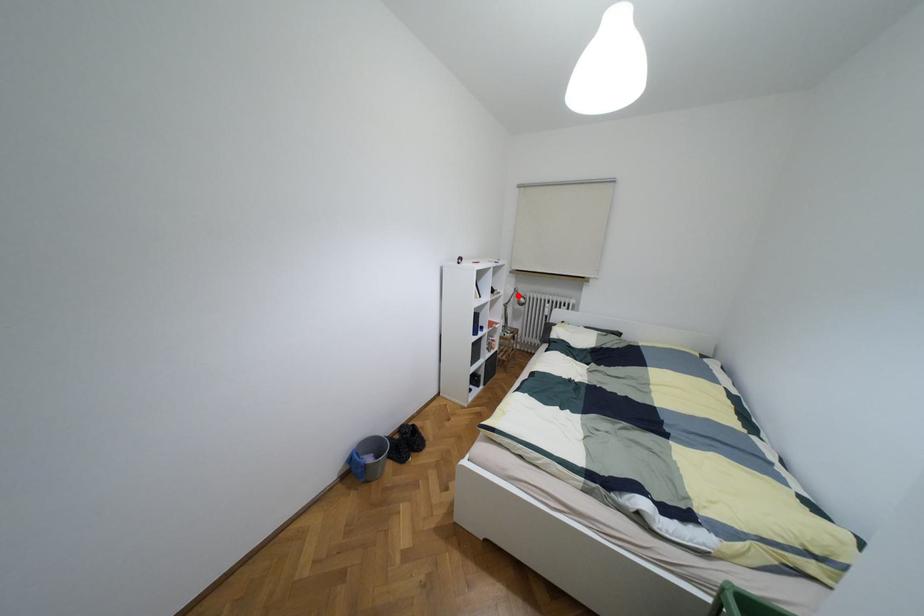
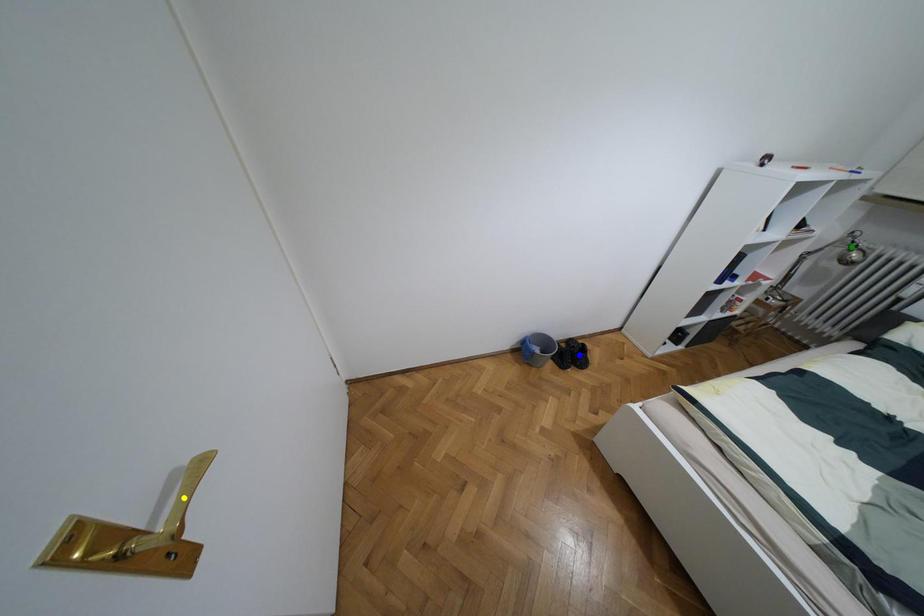
Question: I am providing you with two images of the same scene from different viewpoints. A red point is marked on the first image. You are given multiple points on the second image. Which point in image 2 represents the same 3d spot as the red point in image 1?

Choices:
 (A) green point
 (B) blue point
 (C) yellow point

Answer: (A)